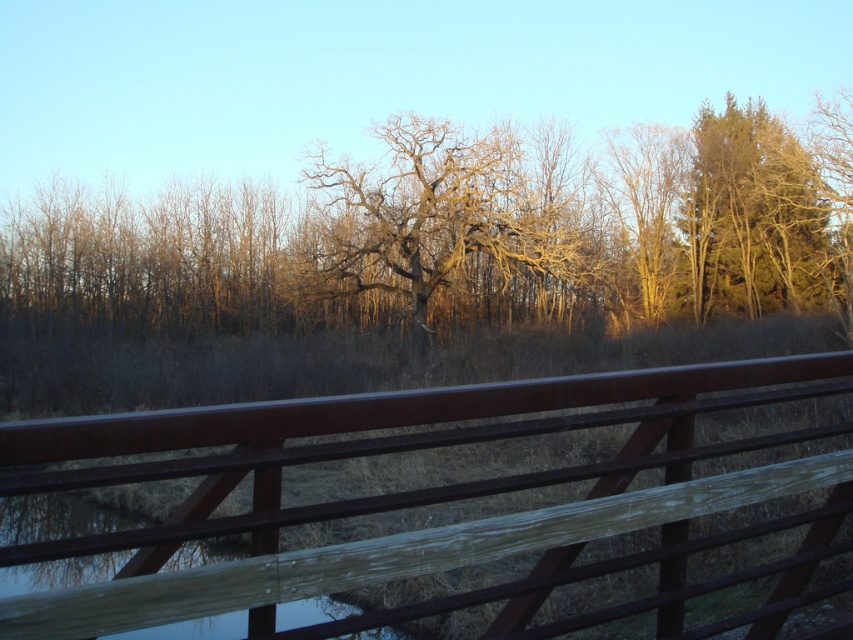
Question: Which object appears closest to the camera in this image?

Choices:
 (A) rustic wood fence at center
 (B) green textured tree at upper right
 (C) transparent water at bridge center
 (D) bare branches at center

Answer: (A)

Question: Is rustic wood fence at center thinner than green textured tree at upper right?

Choices:
 (A) no
 (B) yes

Answer: (B)

Question: Is rustic wood fence at center further to camera compared to bare wood tree at center?

Choices:
 (A) yes
 (B) no

Answer: (B)

Question: Estimate the real-world distances between objects in this image. Which object is closer to the transparent water at bridge center?

Choices:
 (A) rustic wood fence at center
 (B) bare branches at center
 (C) green textured tree at upper right

Answer: (A)

Question: Which object is positioned farthest from the green textured tree at upper right?

Choices:
 (A) bare branches at center
 (B) bare wood tree at center
 (C) transparent water at bridge center

Answer: (C)

Question: Observing the image, what is the correct spatial positioning of rustic wood fence at center in reference to bare wood tree at center?

Choices:
 (A) above
 (B) below

Answer: (B)